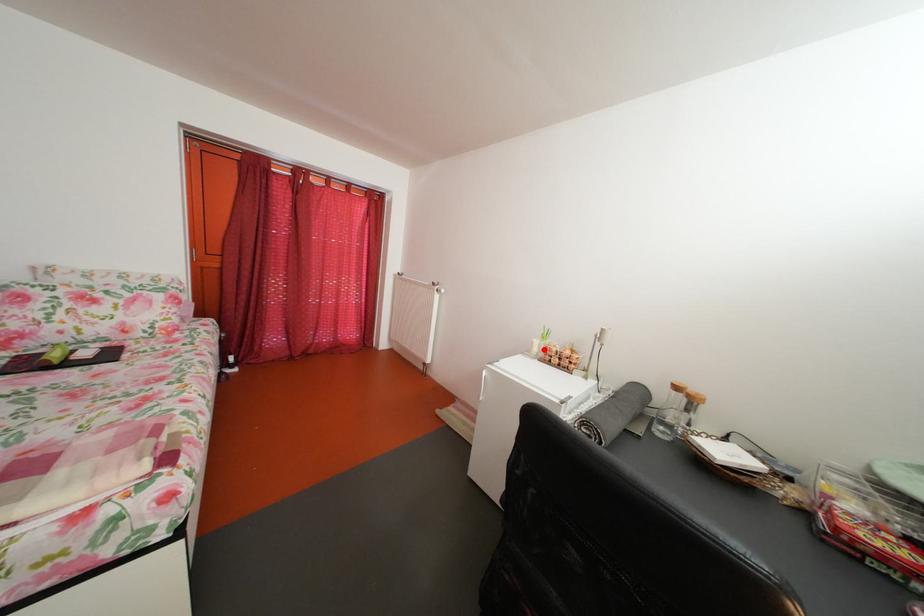
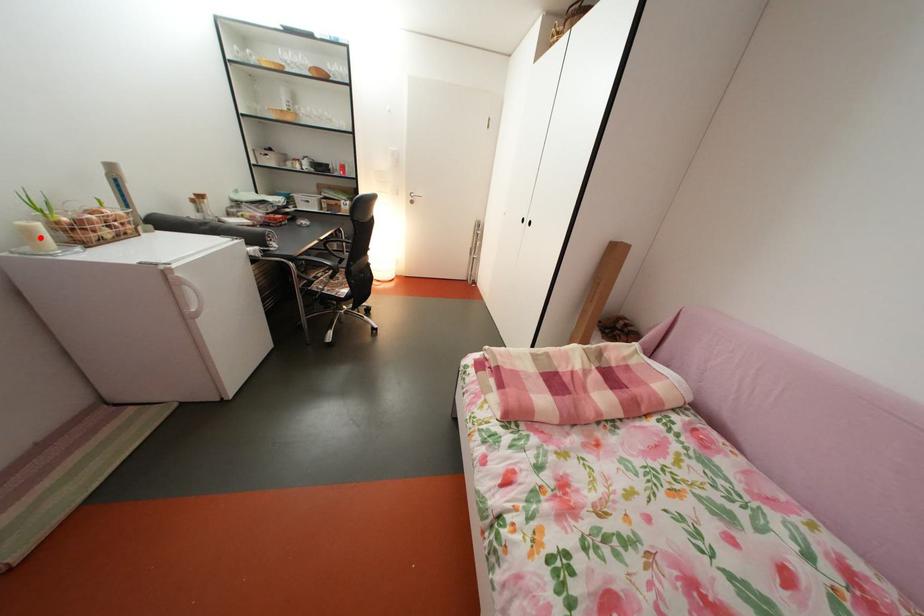
I am providing you with two images of the same scene from different viewpoints. A red point is marked on the first image and another point is marked on the second image. Does the point marked in image1 correspond to the same location as the one in image2?

Yes